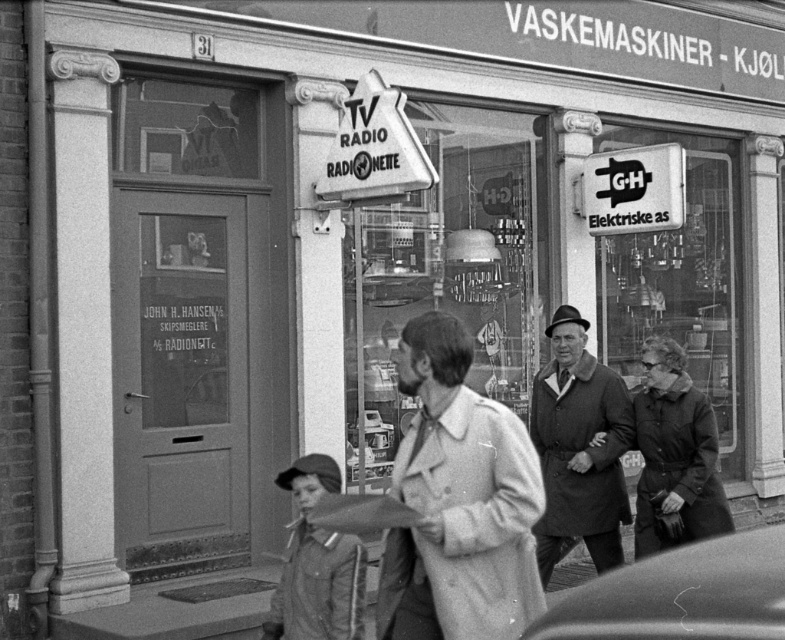
Question: Considering the real-world distances, which object is closest to the coated fabric coat at center?

Choices:
 (A) metallic glass display at center
 (B) light gray wool coat at center
 (C) denim jacket at lower center
 (D) matte black umbrella at center

Answer: (C)

Question: Estimate the real-world distances between objects in this image. Which object is closer to the light gray wool coat at center?

Choices:
 (A) denim jacket at lower center
 (B) matte black umbrella at center

Answer: (B)

Question: Which of the following is the farthest from the observer?

Choices:
 (A) coated fabric coat at center
 (B) light gray wool coat at center

Answer: (A)

Question: Does light gray wool coat at center have a greater width compared to metallic car at lower right?

Choices:
 (A) no
 (B) yes

Answer: (A)

Question: Does metallic glass display at center have a lesser width compared to matte black umbrella at center?

Choices:
 (A) yes
 (B) no

Answer: (B)

Question: Can you confirm if metallic glass display at center is positioned below denim jacket at lower center?

Choices:
 (A) yes
 (B) no

Answer: (B)